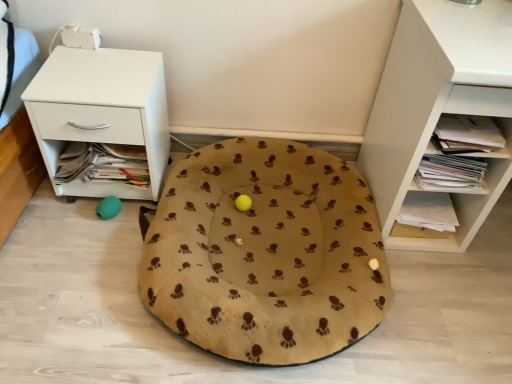
Where is `free point above white glossy nightstand at left (from a real-world perspective)`? The height and width of the screenshot is (384, 512). free point above white glossy nightstand at left (from a real-world perspective) is located at coordinates (95, 75).